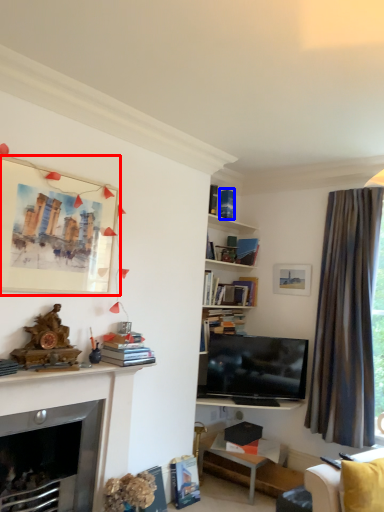
Question: Which object appears closest to the camera in this image, picture frame (highlighted by a red box) or book (highlighted by a blue box)?

Choices:
 (A) picture frame
 (B) book

Answer: (A)